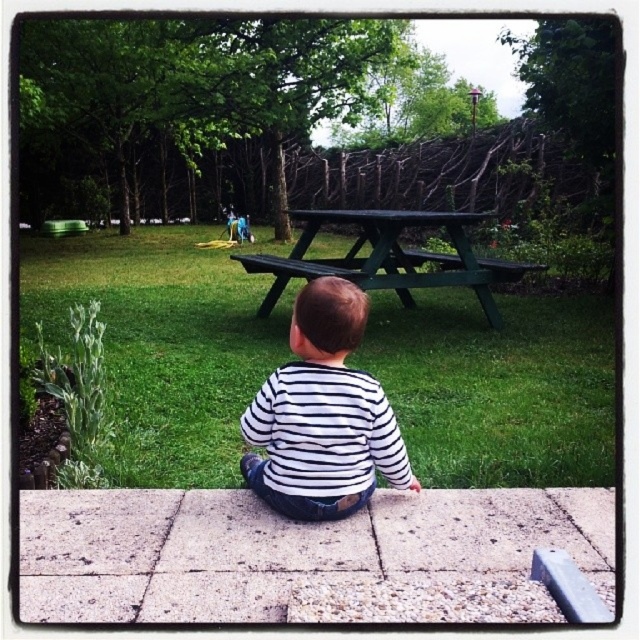
Is green grass at center closer to the viewer compared to striped cotton shirt at center?

No.

This screenshot has width=640, height=640. I want to click on green grass at center, so click(163, 340).

Does point (410, 342) come farther from viewer compared to point (317, 499)?

Yes, it is behind point (317, 499).

Locate an element on the screen. This screenshot has height=640, width=640. green grass at center is located at coordinates click(x=163, y=340).

Who is positioned more to the left, striped cotton shirt at center or green matte picnic table at center?

striped cotton shirt at center

Is point (358, 323) less distant than point (508, 272)?

Yes.

Between point (356, 428) and point (296, 266), which one is positioned in front?

Point (356, 428) is more forward.

Locate an element on the screen. The width and height of the screenshot is (640, 640). striped cotton shirt at center is located at coordinates (323, 416).

Does green grass at center appear on the right side of green matte picnic table at center?

No, green grass at center is not to the right of green matte picnic table at center.

Who is more distant from viewer, [412,312] or [364,236]?

Positioned behind is point [364,236].

The height and width of the screenshot is (640, 640). In order to click on green grass at center in this screenshot , I will do `click(163, 340)`.